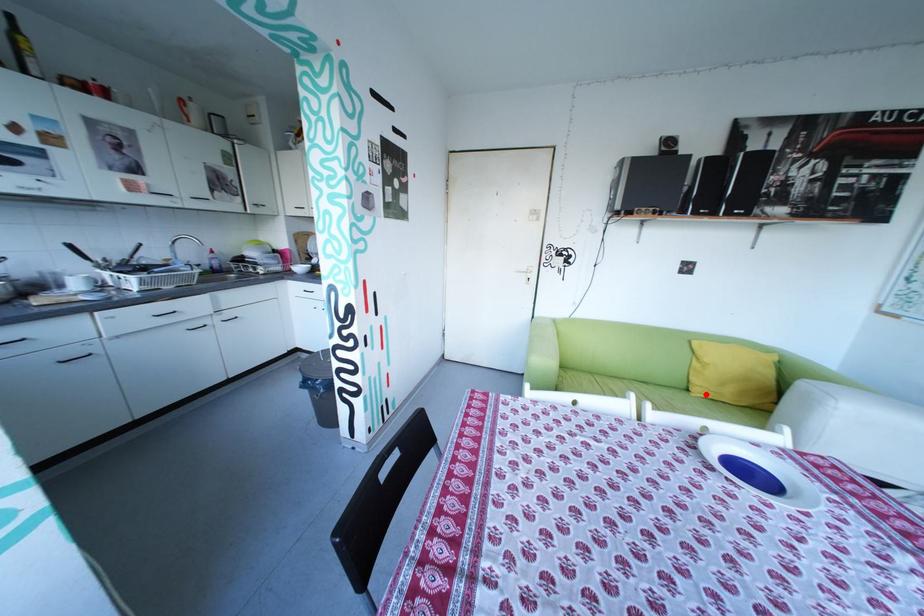
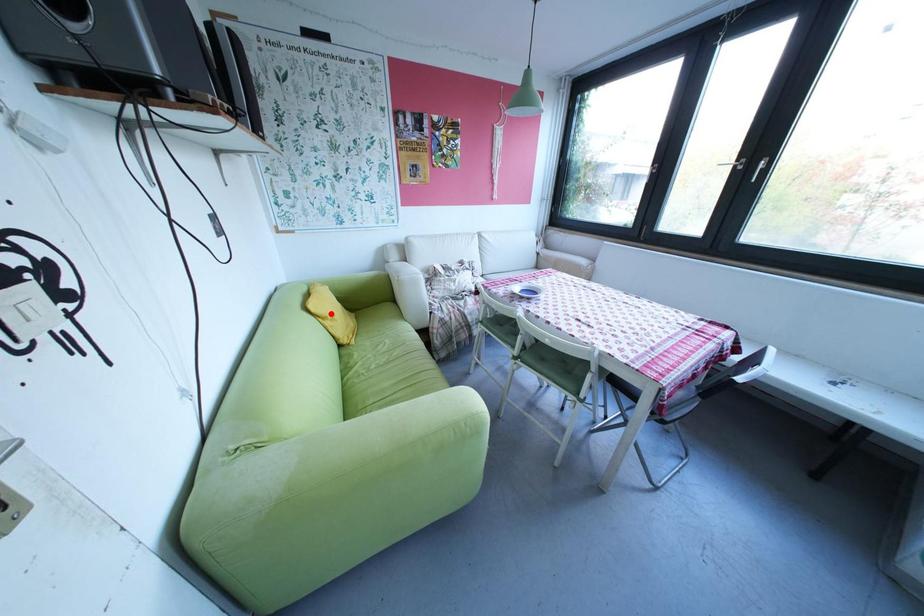
I am providing you with two images of the same scene from different viewpoints. A red point is marked on the first image and another point is marked on the second image. Does the point marked in image1 correspond to the same location as the one in image2?

No